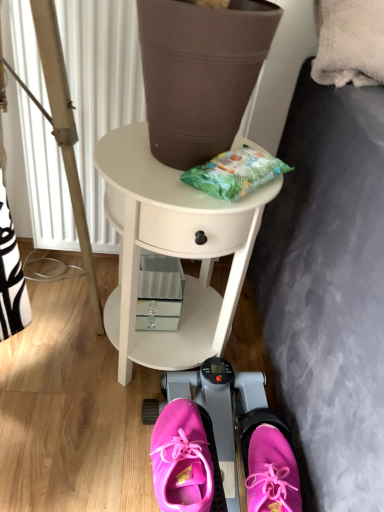
Where is `free location in front of white glossy side table at center`? The height and width of the screenshot is (512, 384). free location in front of white glossy side table at center is located at coordinates (78, 456).